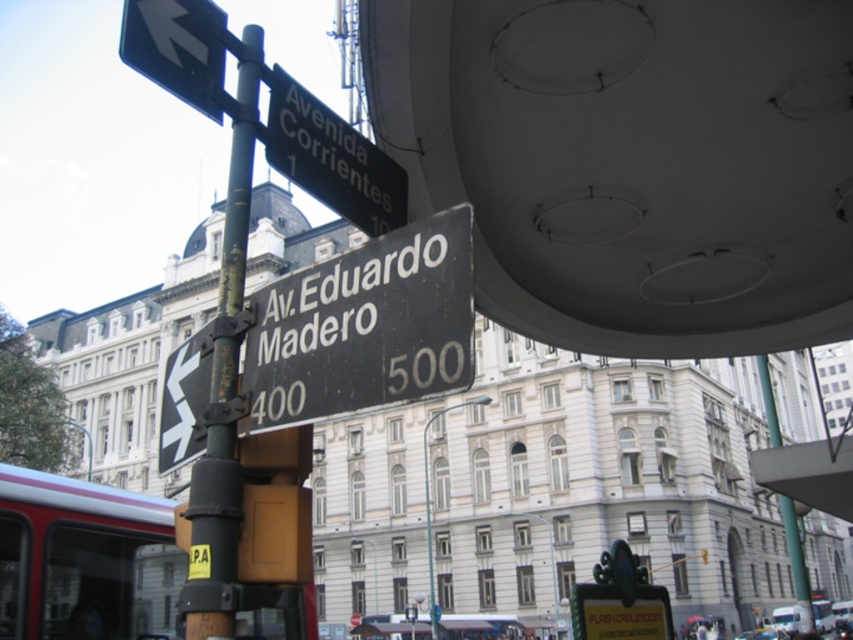
What are the coordinates of the black matte street sign at center?

The black matte street sign at center is located at coordinates point (363, 326).

You are a delivery driver who needs to read the address on the black matte street sign at center. However, there is a black plastic arrow at upper left pointing away from the sign. Will the arrow block your view of the street sign?

The black matte street sign at center is larger than the black plastic arrow at upper left, so the arrow is less likely to block the entire view of the street sign. However, part of the sign might still be obscured depending on the arrow placement.

You are a delivery driver who needs to deliver a package to a building located at the corner of Avenida Corrientes and Av. Eduardo Madero. You see the black matte street sign at center and the black plastic street sign at upper center. Which of these signs shows the address numbers for the buildings on Avenida Corrientes?

The black plastic street sign at upper center shows the address numbers for the buildings on Avenida Corrientes because it is taller than the black matte street sign at center, and taller signs often display more detailed information like address ranges.